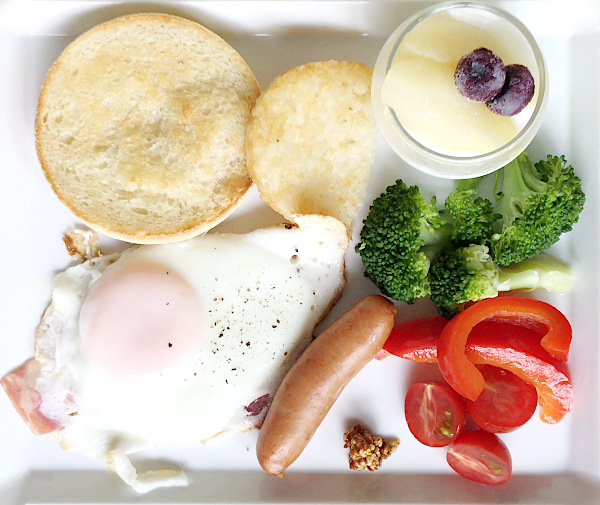
Locate an element on the screen. plate is located at coordinates (371, 403).